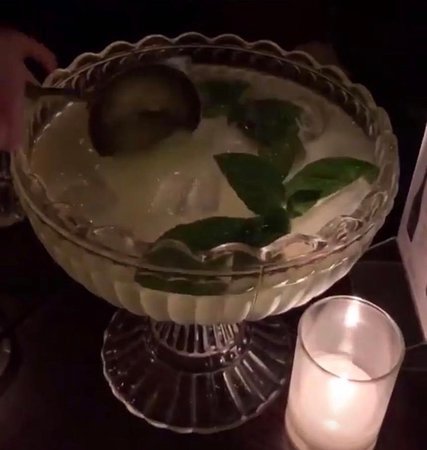
Identify the location of table. (72, 371).